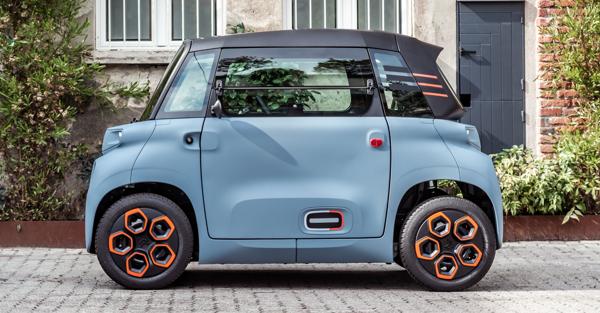
Where is `door handle`? This screenshot has width=600, height=313. door handle is located at coordinates (469, 50).